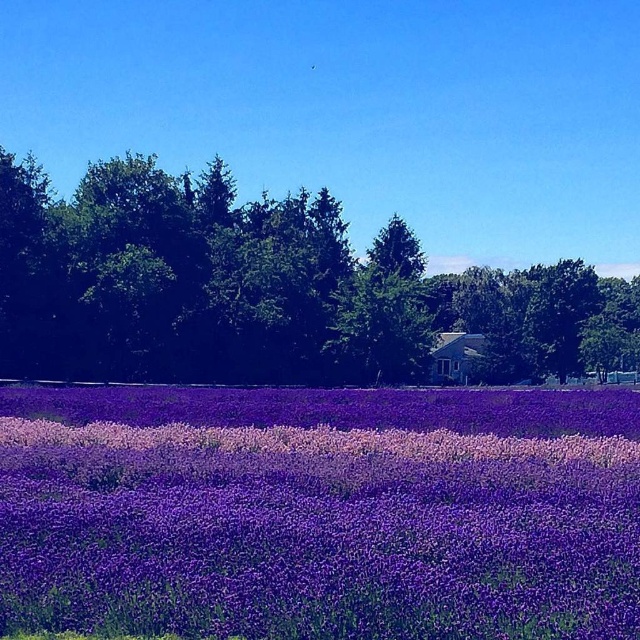
Can you confirm if purple soft-textured flowers at center is shorter than green leafy tree at center?

Yes.

Where is `purple soft-textured flowers at center`? purple soft-textured flowers at center is located at coordinates (321, 513).

Who is more forward, (604,426) or (269,212)?

Positioned in front is point (604,426).

Identify the location of purple soft-textured flowers at center. Image resolution: width=640 pixels, height=640 pixels. (321, 513).